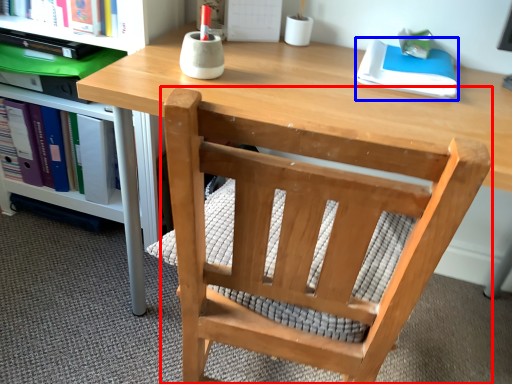
Question: Which point is closer to the camera, chair (highlighted by a red box) or paperback book (highlighted by a blue box)?

Choices:
 (A) chair
 (B) paperback book

Answer: (A)